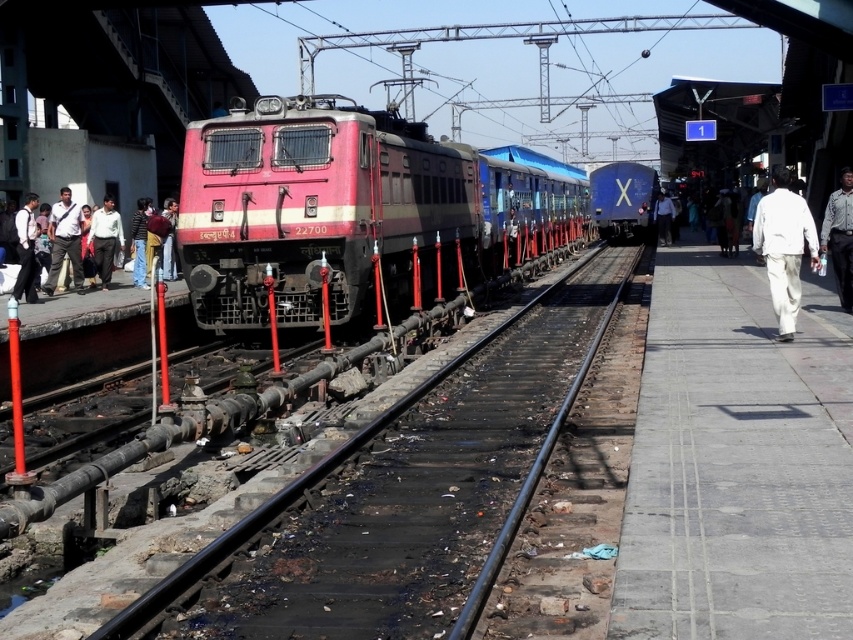
You are a photographer standing on the platform at the railway station. You want to take a photo of the blue glossy train at center and the white textured shirt at right in the same frame. Which object should you zoom in on to ensure both are visible without cropping?

The blue glossy train at center is bigger than the white textured shirt at right, so you should zoom out to capture both objects in the frame without cropping.

You are standing on the platform at the railway station and want to cross the tracks safely. The black metal train track at center is located at coordinates point 0.777, 0.472. Where exactly should you go to cross the tracks safely?

To cross the tracks safely, you should go to the designated crossing point, which is not indicated in the provided coordinates. The coordinates given are for the track itself, so it is unsafe to cross there. Please locate a proper crossing point away from the tracks.

You are a pedestrian standing on the platform and want to cross the tracks safely. The black metal train track at center and the dark blue shirt at left are in your line of sight. Which object should you look at first to ensure safety?

You should look at the black metal train track at center first because it is closer to you than the dark blue shirt at left, so it poses an immediate safety risk.